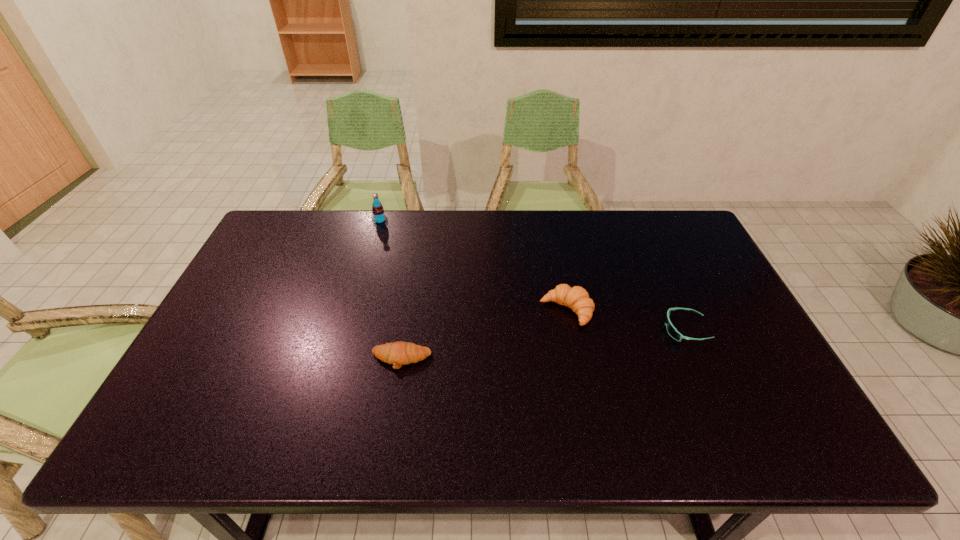
This screenshot has width=960, height=540. I want to click on free point between the second object from left to right and the leftmost object, so click(x=391, y=290).

You are a GUI agent. You are given a task and a screenshot of the screen. Output one action in this format:
    pyautogui.click(x=<x>, y=<y>)
    Task: Click on the closest object to the leftmost object
    
    Given the screenshot: What is the action you would take?
    (x=399, y=353)

Identify the location of object that stands as the third closest to the right crescent roll. This screenshot has width=960, height=540. (378, 217).

Where is `vacant region that satisfies the following two spatial constraints: 1. on the back side of the second object from left to right; 2. on the right side of the second object from right to left`? The height and width of the screenshot is (540, 960). vacant region that satisfies the following two spatial constraints: 1. on the back side of the second object from left to right; 2. on the right side of the second object from right to left is located at coordinates (409, 310).